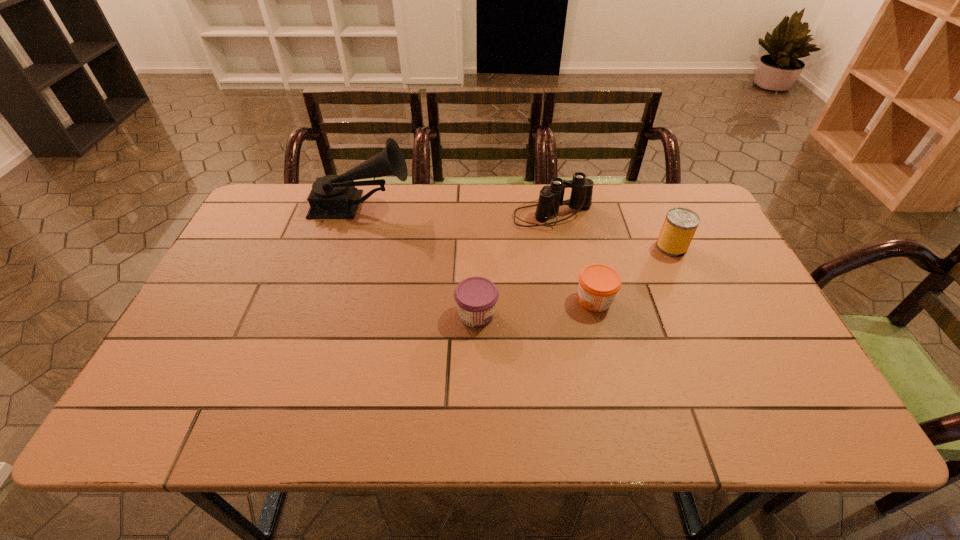
At what (x,y) coordinates should I click in order to perform the action: click on vacant space at the right edge of the desktop. Please return your answer as a coordinate pair (x, y). Looking at the image, I should click on (703, 308).

You are a GUI agent. You are given a task and a screenshot of the screen. Output one action in this format:
    pyautogui.click(x=<x>, y=<y>)
    Task: Click on the free spot at the far left corner of the desktop
    
    Given the screenshot: What is the action you would take?
    pyautogui.click(x=265, y=211)

This screenshot has height=540, width=960. I want to click on free space between the phonograph_record and the binoculars, so click(x=457, y=211).

Locate an element on the screen. This screenshot has width=960, height=540. unoccupied position between the right jam and the fourth object from right to left is located at coordinates 536,307.

I want to click on vacant area that lies between the binoculars and the leftmost object, so click(457, 211).

This screenshot has height=540, width=960. Identify the location of free space that is in between the can and the right jam. (633, 273).

Where is `free space between the third farthest object and the second object from left to right`? The image size is (960, 540). free space between the third farthest object and the second object from left to right is located at coordinates (574, 281).

Where is `unoccupied position between the tallest object and the rightmost object`? unoccupied position between the tallest object and the rightmost object is located at coordinates (516, 227).

I want to click on free space between the left jam and the third nearest object, so click(574, 281).

Locate an element on the screen. vacant space that's between the leftmost object and the binoculars is located at coordinates (457, 211).